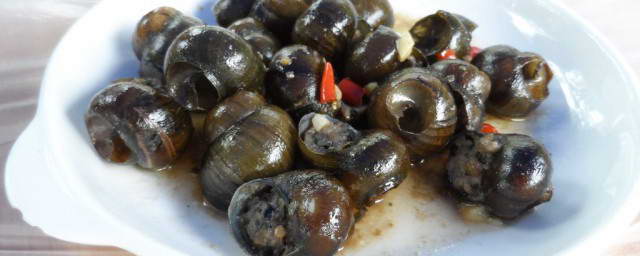
The height and width of the screenshot is (256, 640). In order to click on empty space between table and bowl in this screenshot , I will do `click(628, 250)`.